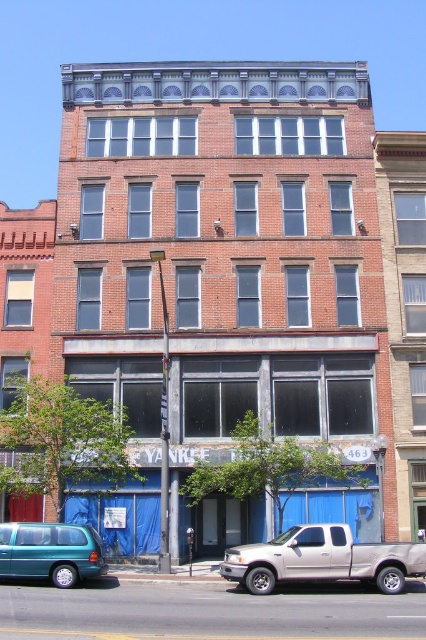
Question: Does silver metallic truck at lower center have a larger size compared to teal matte van at lower left?

Choices:
 (A) no
 (B) yes

Answer: (B)

Question: Does silver metallic truck at lower center have a larger size compared to teal matte van at lower left?

Choices:
 (A) yes
 (B) no

Answer: (A)

Question: Can you confirm if silver metallic truck at lower center is positioned below teal matte van at lower left?

Choices:
 (A) yes
 (B) no

Answer: (A)

Question: Which point is farther to the camera?

Choices:
 (A) (25, 557)
 (B) (244, 584)

Answer: (A)

Question: Which point is farther to the camera?

Choices:
 (A) (227, 568)
 (B) (69, 554)

Answer: (A)